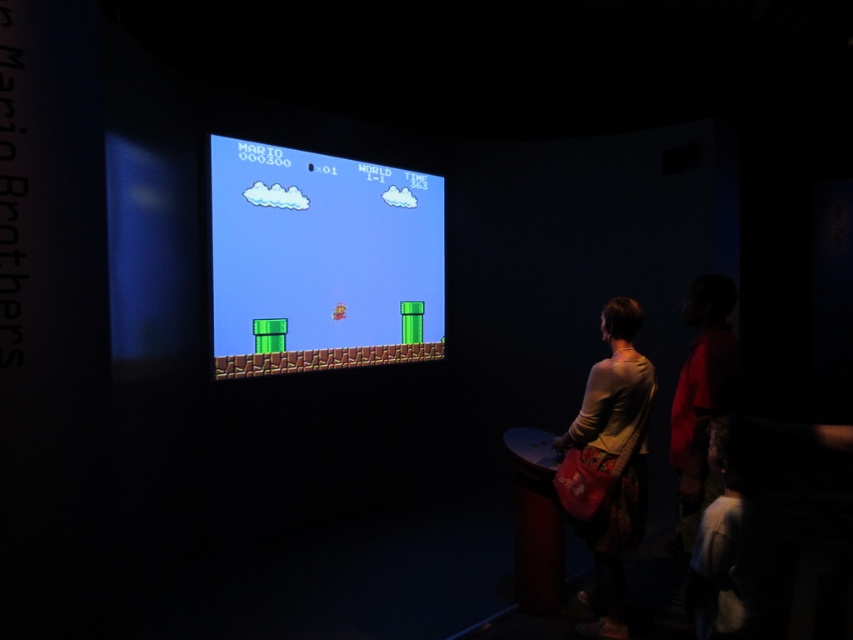
This screenshot has height=640, width=853. What do you see at coordinates (321, 260) in the screenshot?
I see `matte plastic screen at center` at bounding box center [321, 260].

Which is behind, point (259, 298) or point (642, 358)?

Positioned behind is point (259, 298).

Locate an element on the screen. This screenshot has width=853, height=640. matte plastic screen at center is located at coordinates (321, 260).